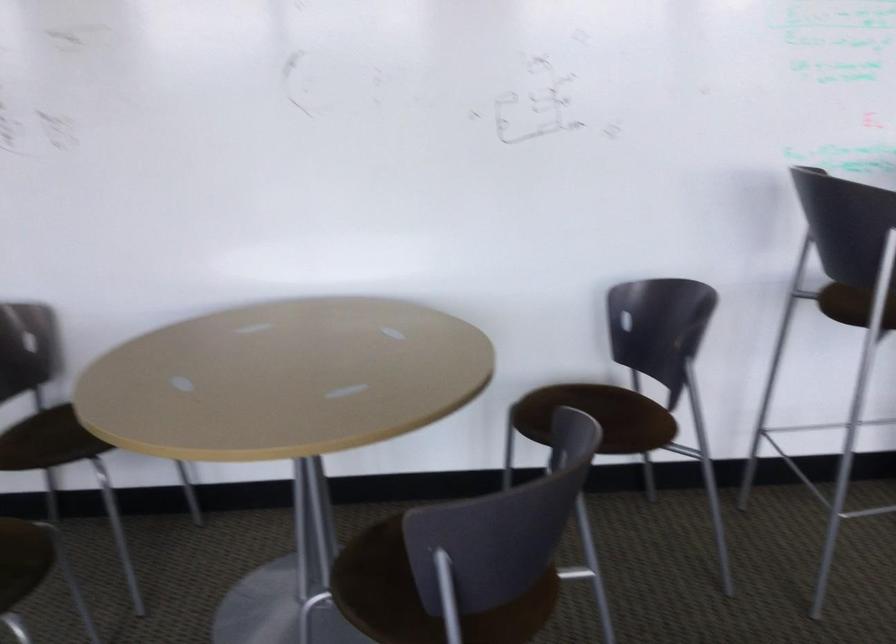
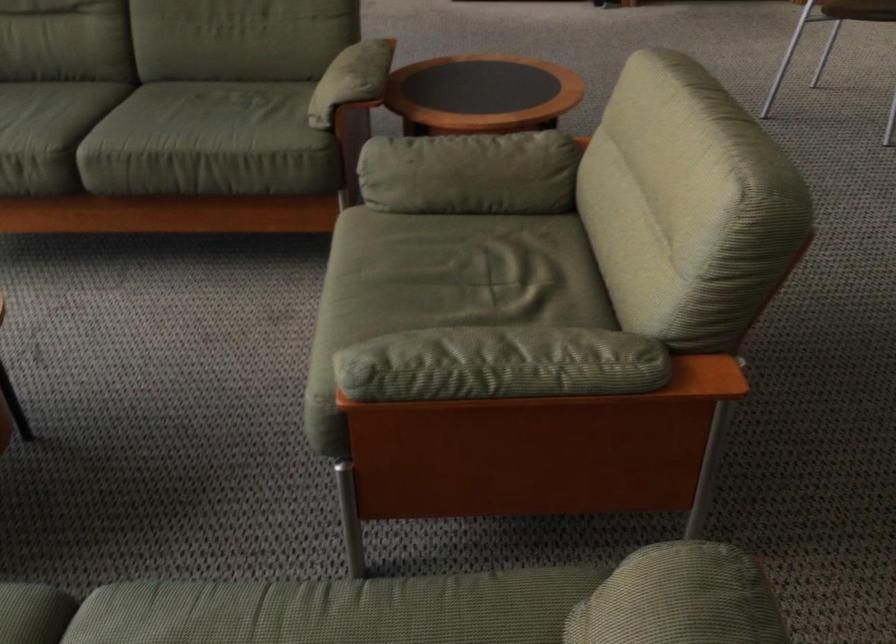
First-person continuous shooting, in which direction is the camera rotating?

The camera rotated toward left-down.